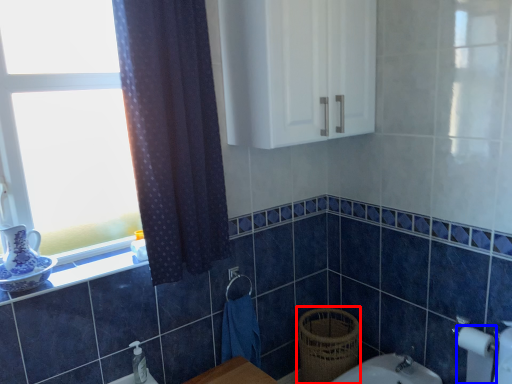
Question: Among these objects, which one is farthest to the camera, basket (highlighted by a red box) or toilet paper (highlighted by a blue box)?

Choices:
 (A) basket
 (B) toilet paper

Answer: (A)